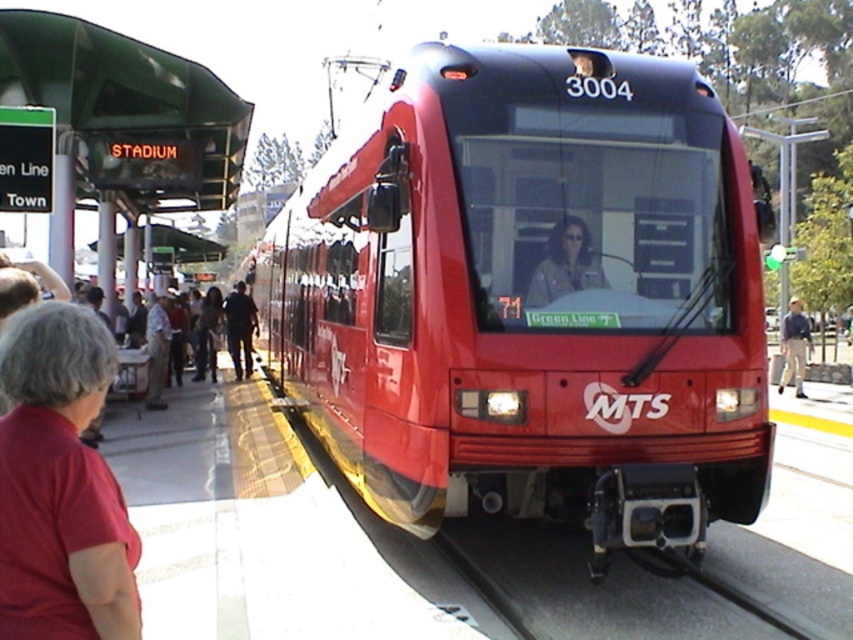
Question: Does khaki fabric jacket at center appear over dark blue jeans at center?

Choices:
 (A) yes
 (B) no

Answer: (A)

Question: Which of the following is the farthest from the observer?

Choices:
 (A) red cotton shirt at lower left
 (B) blue denim jeans at right

Answer: (B)

Question: Can you confirm if red cotton shirt at lower left is wider than dark blue jeans at center?

Choices:
 (A) yes
 (B) no

Answer: (B)

Question: Estimate the real-world distances between objects in this image. Which object is farther from the dark blue jeans at center?

Choices:
 (A) black rubber train track at lower center
 (B) red cotton shirt at lower left
 (C) khaki fabric jacket at center

Answer: (B)

Question: Which of the following is the closest to the observer?

Choices:
 (A) glossy red train at center
 (B) black rubber train track at lower center

Answer: (B)

Question: Does red cotton shirt at lower left have a lesser width compared to blue denim jeans at right?

Choices:
 (A) yes
 (B) no

Answer: (A)